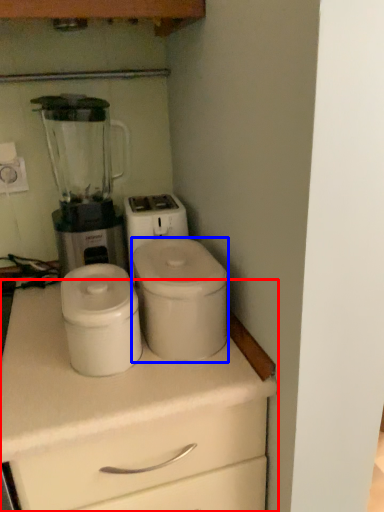
Question: Which object appears closest to the camera in this image, chest of drawers (highlighted by a red box) or appliance (highlighted by a blue box)?

Choices:
 (A) chest of drawers
 (B) appliance

Answer: (A)